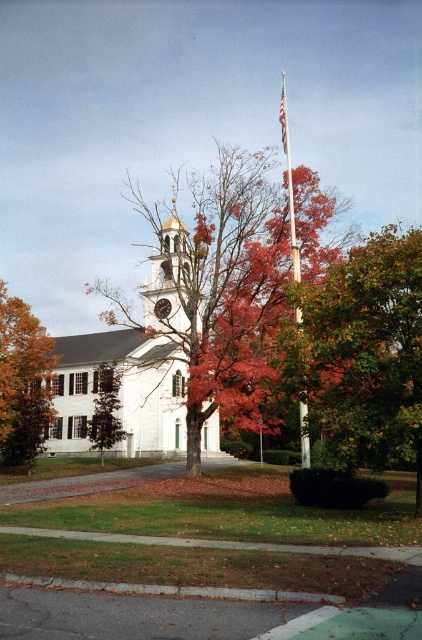
Question: Estimate the real-world distances between objects in this image. Which object is farther from the green matte tree at center?

Choices:
 (A) white smooth flag pole at center
 (B) white matte church at center
 (C) white fabric flag at center
 (D) autumn leaves at center

Answer: (C)

Question: Which point is closer to the camera?

Choices:
 (A) orange leafy tree at left
 (B) autumn leaves at center
 (C) white fabric flag at center
 (D) white smooth flag pole at center

Answer: (D)

Question: Does orange leafy tree at left appear on the left side of white smooth flag pole at center?

Choices:
 (A) yes
 (B) no

Answer: (A)

Question: Does orange leafy tree at left come in front of green matte tree at center?

Choices:
 (A) no
 (B) yes

Answer: (B)

Question: Which object is the closest to the autumn leaves at center?

Choices:
 (A) green matte tree at center
 (B) white smooth flag pole at center

Answer: (B)

Question: Does white smooth flag pole at center have a smaller size compared to white fabric flag at center?

Choices:
 (A) yes
 (B) no

Answer: (B)